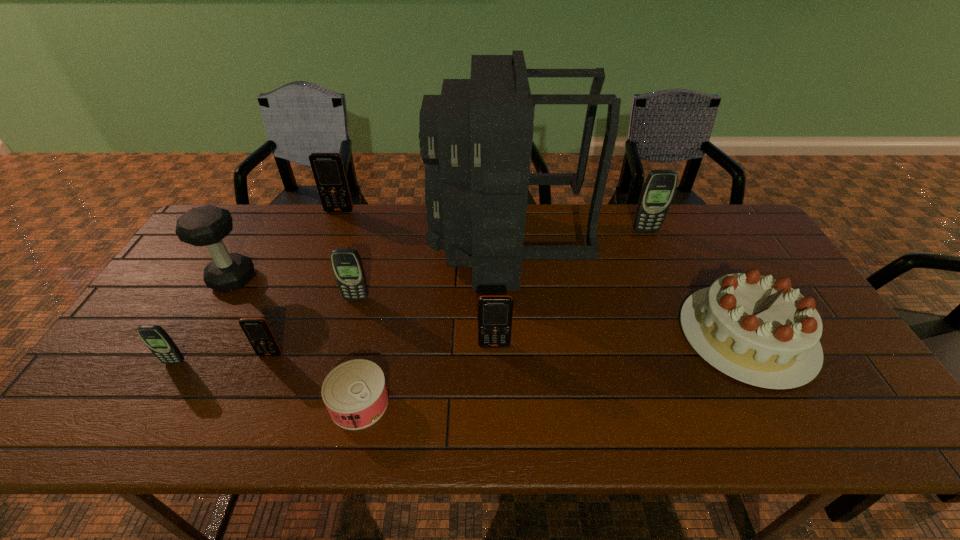
The width and height of the screenshot is (960, 540). I want to click on the fourth farthest cellular telephone, so click(495, 312).

Identify the location of birthday cake. (758, 330).

Where is `the second nearest cellular telephone`? The height and width of the screenshot is (540, 960). the second nearest cellular telephone is located at coordinates (257, 330).

Locate an element on the screen. The height and width of the screenshot is (540, 960). the nearest orange cellular telephone is located at coordinates click(257, 330).

You are a GUI agent. You are given a task and a screenshot of the screen. Output one action in this format:
    pyautogui.click(x=<x>, y=<y>)
    Task: Click on the smallest gray cellular telephone
    The height and width of the screenshot is (540, 960).
    Given the screenshot: What is the action you would take?
    [155, 337]

This screenshot has width=960, height=540. I want to click on the nearest cellular telephone, so click(155, 337).

I want to click on can, so click(x=355, y=393).

Identify the location of free region located 0.400m on the front compartment of the backpack. (306, 246).

The height and width of the screenshot is (540, 960). Find the location of `blank space located 0.310m on the front compartment of the backpack`. blank space located 0.310m on the front compartment of the backpack is located at coordinates (335, 246).

Where is `free region located on the front compartment of the backpack`? Image resolution: width=960 pixels, height=540 pixels. free region located on the front compartment of the backpack is located at coordinates (366, 246).